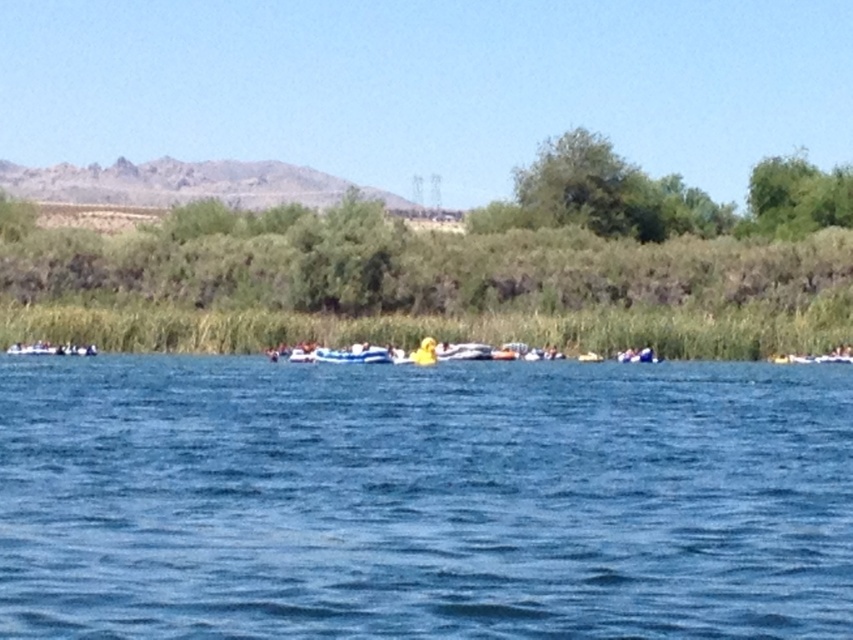
Is blue water at center bigger than yellow rubber boat at center?

Yes, blue water at center is bigger than yellow rubber boat at center.

Measure the distance between blue water at center and camera.

blue water at center and camera are 8.10 meters apart from each other.

Find the location of `blue water at center`. blue water at center is located at coordinates (422, 499).